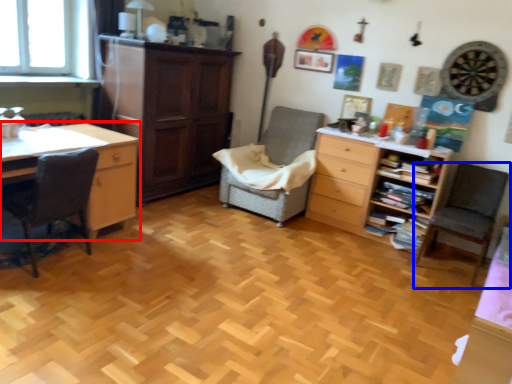
Question: Which of the following is the farthest to the observer, desk (highlighted by a red box) or chair (highlighted by a blue box)?

Choices:
 (A) desk
 (B) chair

Answer: (B)